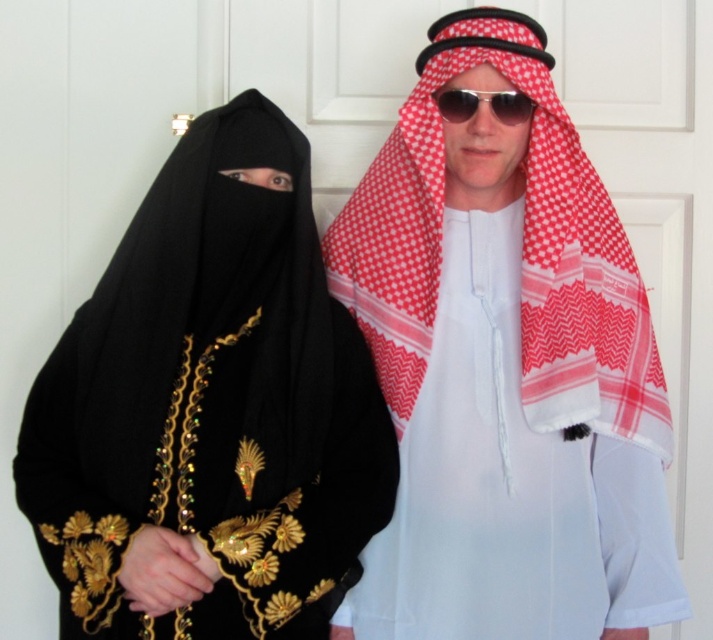
You are a photographer standing at a distance. You want to take a closeup photo of the red checkered scarf at upper right without moving the subject. Can you adjust your camera zoom to capture the scarf clearly?

The red checkered scarf at upper right is 1.37 meters away from the viewer. Yes, you can adjust your camera zoom to capture the scarf clearly from that distance.

You are a fashion designer observing two accessories in the image. The black velvet abaya at left and the white woven keffiyeh at center. Which of these two accessories is taller?

The black velvet abaya at left is taller than the white woven keffiyeh at center.

You are a fashion designer observing two accessories in the image. The red checkered scarf at upper right and the sunglasses at center. Which accessory has a bigger size?

The red checkered scarf at upper right has a larger size compared to the sunglasses at center.